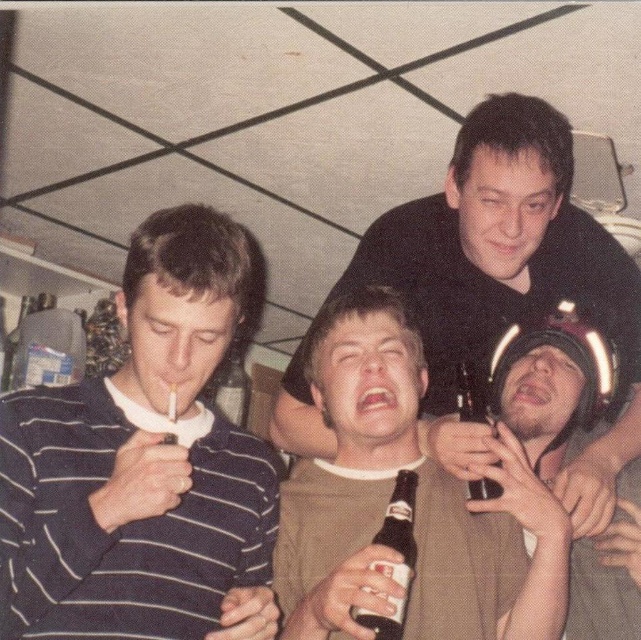
You are standing at the origin point of the coordinate system in the image. The translucent glass beer bottle at lower right is located at point (470, 394). If you want to move towards the translucent glass beer bottle at lower right, in which direction should you move?

The point (470, 394) is located at the lower right of the image, so to move towards the translucent glass beer bottle at lower right, you should move towards the lower right direction.

You are standing in the room and want to place a small plant pot at point (x=119, y=429). The plant pot requires 2 feet of space in front of it for watering. Is there enough space?

The distance of point (x=119, y=429) from viewer is 3.68 feet, so yes, there is enough space to place the plant pot there since 3.68 feet is greater than the required 2 feet.